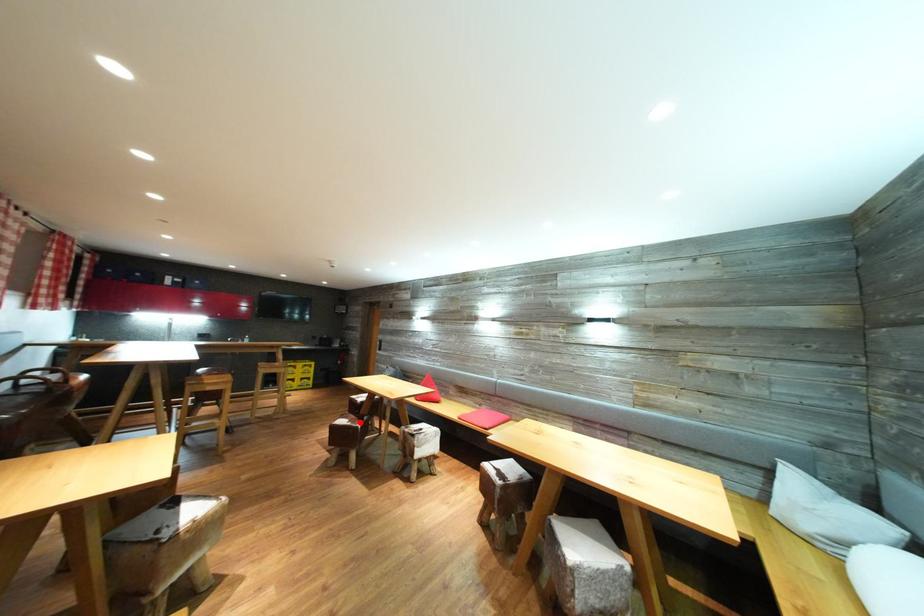
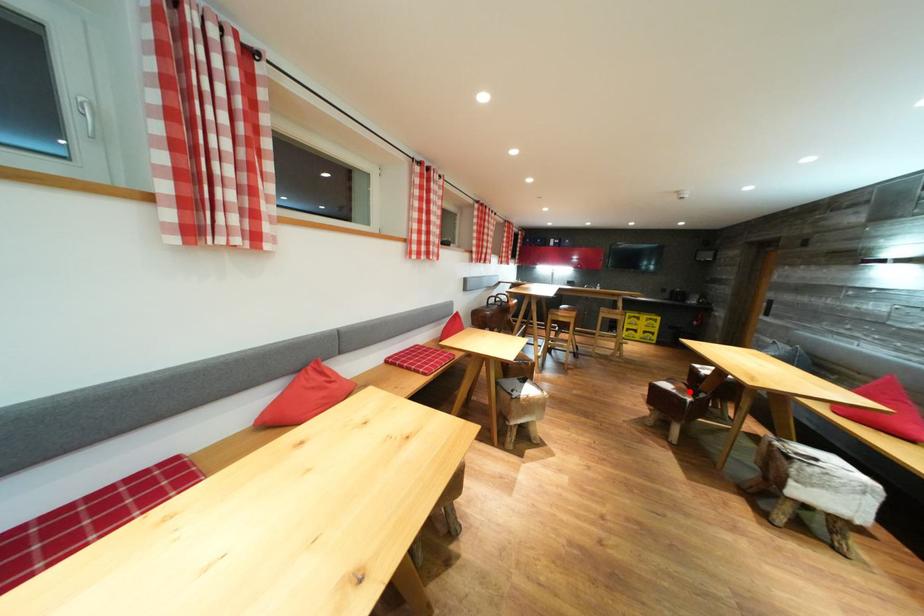
I am providing you with two images of the same scene from different viewpoints. A red point is marked on the first image and another point is marked on the second image. Is the red point in image1 aligned with the point shown in image2?

Yes